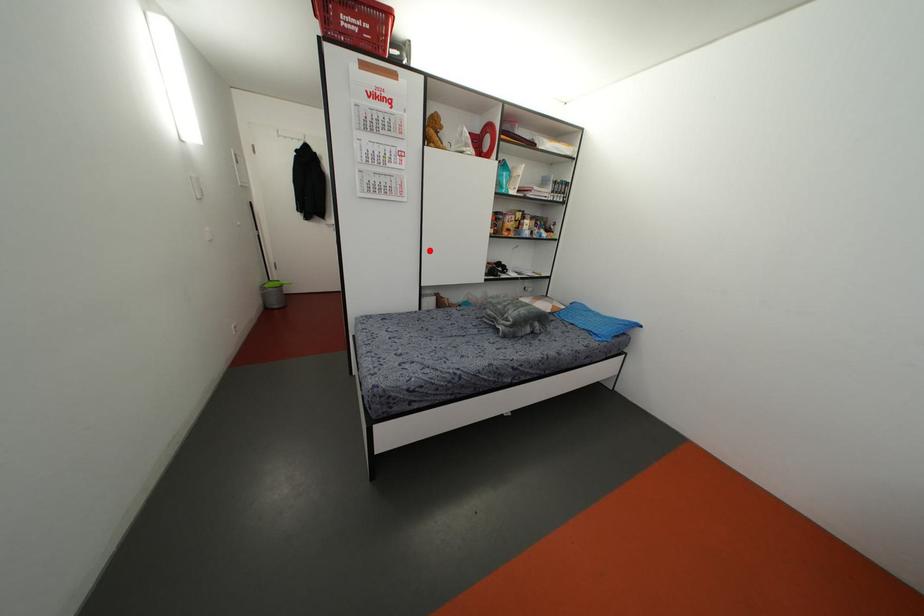
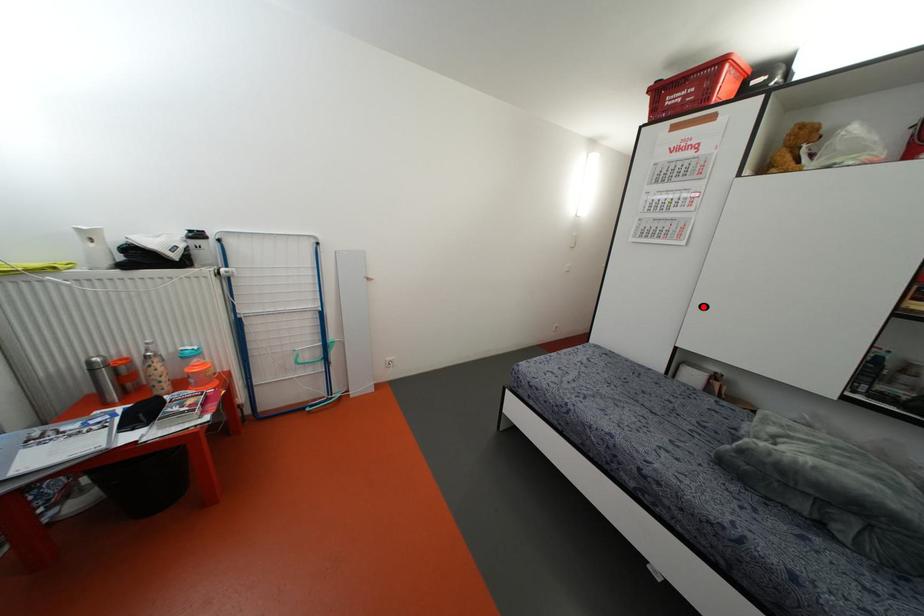
I am providing you with two images of the same scene from different viewpoints. A red point is marked on the first image and another point is marked on the second image. Does the point marked in image1 correspond to the same location as the one in image2?

Yes